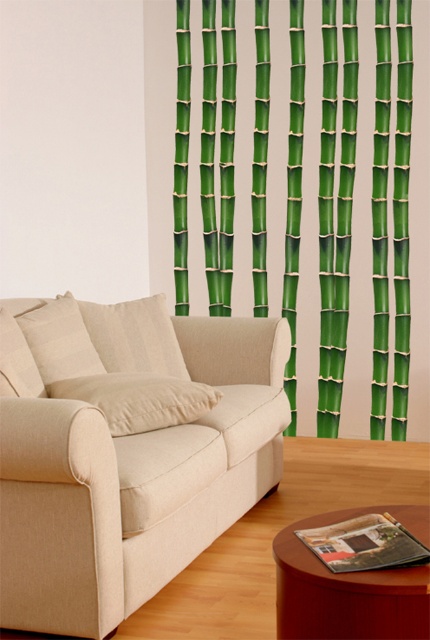
Question: Is beige fabric couch at left to the left of green bamboo at upper right from the viewer's perspective?

Choices:
 (A) no
 (B) yes

Answer: (B)

Question: Which of the following is the closest to the observer?

Choices:
 (A) (273, 545)
 (B) (288, 422)

Answer: (A)

Question: Estimate the real-world distances between objects in this image. Which object is farther from the green bamboo at upper right?

Choices:
 (A) wooden round table at lower right
 (B) beige fabric couch at left

Answer: (A)

Question: Is green bamboo at upper right to the left of wooden round table at lower right from the viewer's perspective?

Choices:
 (A) yes
 (B) no

Answer: (B)

Question: Which of the following is the farthest from the observer?

Choices:
 (A) green bamboo at upper right
 (B) wooden round table at lower right
 (C) beige fabric couch at left

Answer: (A)

Question: Does green bamboo at upper right appear over wooden round table at lower right?

Choices:
 (A) no
 (B) yes

Answer: (B)